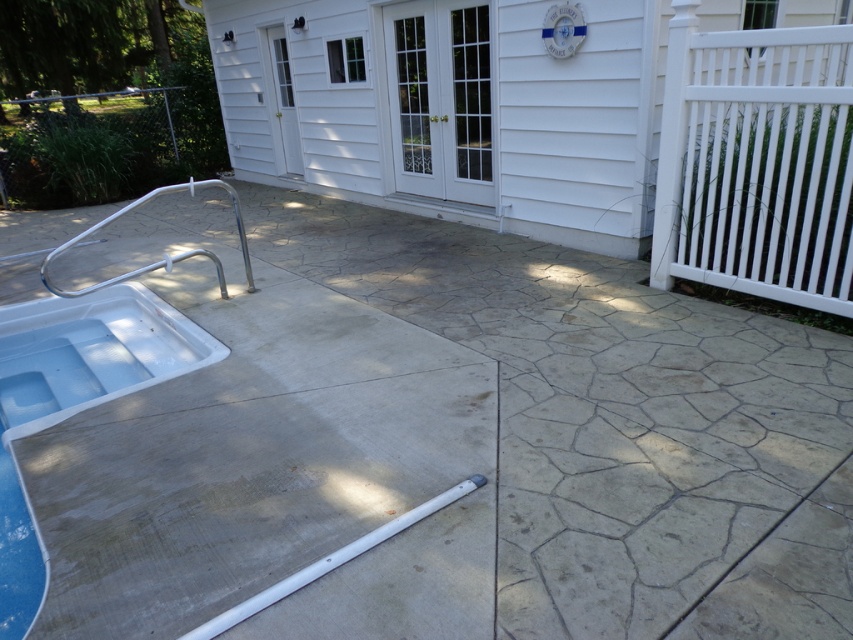
You are standing at the point closest to the house in the backyard. You want to walk to the pool area. Which point should you head towards, point (779, 586) or point (386, 204)?

You should head towards point (779, 586) because it is in front of point (386, 204), meaning it is closer to the pool area.

You are standing in the backyard looking at the pool area. Where is the concrete at lower left located in terms of coordinates?

The concrete at lower left is located at coordinates point (618, 424).